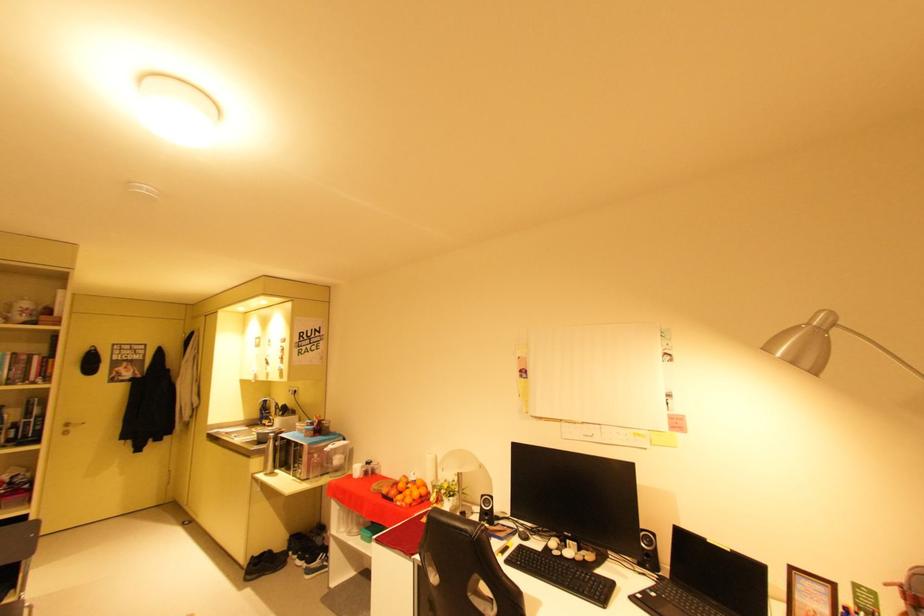
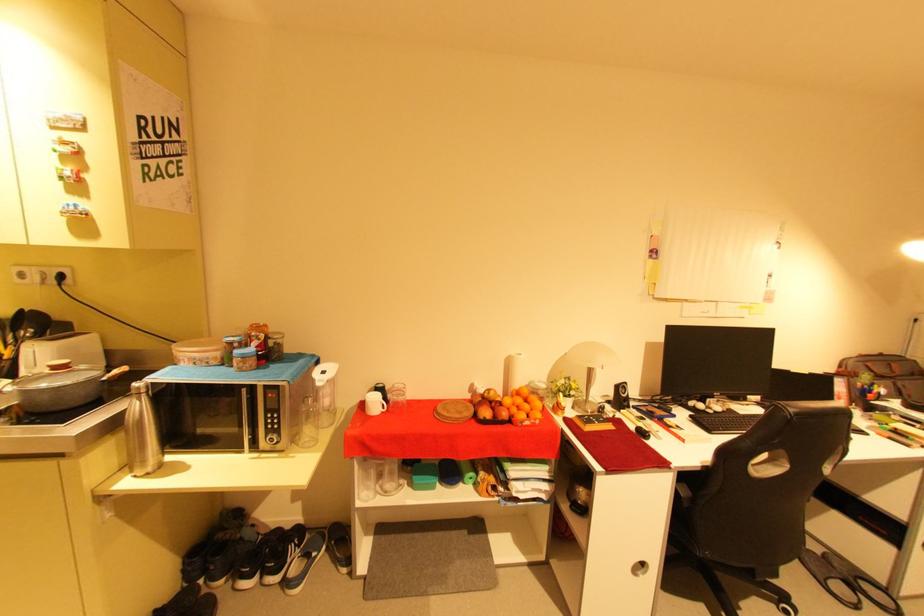
Find the pixel in the second image that matches point 581,560 in the first image.

(730, 411)